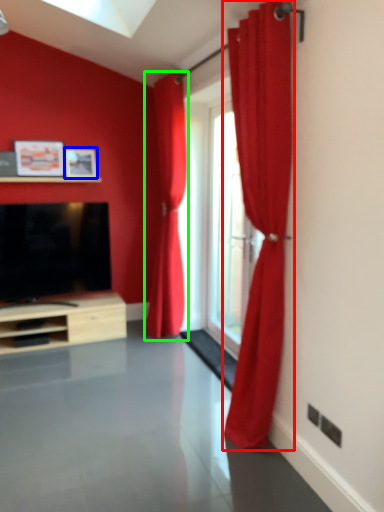
Question: Which object is the closest to the curtain (highlighted by a red box)? Choose among these: picture frame (highlighted by a blue box) or curtain (highlighted by a green box).

Choices:
 (A) picture frame
 (B) curtain

Answer: (B)